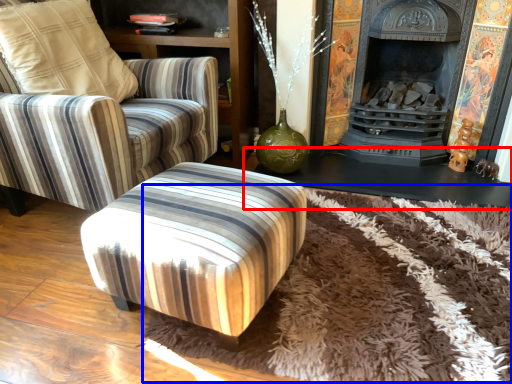
Question: Among these objects, which one is farthest to the camera, table (highlighted by a red box) or mat (highlighted by a blue box)?

Choices:
 (A) table
 (B) mat

Answer: (A)